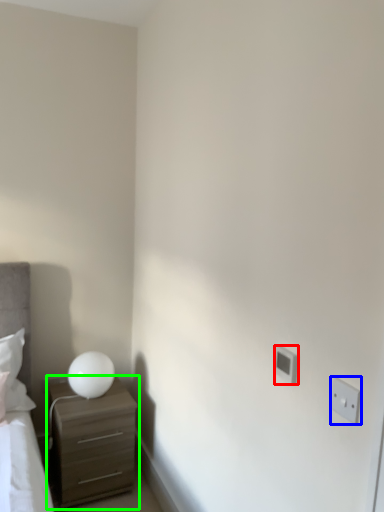
Question: Which is nearer to the electric outlet (highlighted by a red box)? electric outlet (highlighted by a blue box) or chest of drawers (highlighted by a green box).

Choices:
 (A) electric outlet
 (B) chest of drawers

Answer: (A)